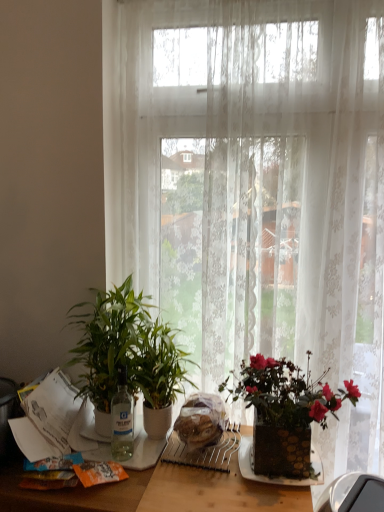
Question: Is transparent glass bottle at center thinner than green glossy plant at left, marked as the 1th houseplant in a left-to-right arrangement?

Choices:
 (A) yes
 (B) no

Answer: (A)

Question: Can you confirm if transparent glass bottle at center is wider than green glossy plant at left, marked as the 1th houseplant in a left-to-right arrangement?

Choices:
 (A) no
 (B) yes

Answer: (A)

Question: Is transparent glass bottle at center at the left side of green glossy plant at left, marked as the 1th houseplant in a left-to-right arrangement?

Choices:
 (A) yes
 (B) no

Answer: (B)

Question: From the image's perspective, is transparent glass bottle at center on top of green glossy plant at left, the second houseplant positioned from the right?

Choices:
 (A) no
 (B) yes

Answer: (A)

Question: Is transparent glass bottle at center shorter than green glossy plant at left, the second houseplant positioned from the right?

Choices:
 (A) yes
 (B) no

Answer: (A)

Question: From a real-world perspective, is green glossy plant at center, acting as the 1th houseplant starting from the right, above or below wooden table at center?

Choices:
 (A) below
 (B) above

Answer: (B)

Question: Is green glossy plant at center, acting as the 1th houseplant starting from the right, bigger or smaller than wooden table at center?

Choices:
 (A) big
 (B) small

Answer: (B)

Question: Is green glossy plant at center, which is the 2th houseplant in left-to-right order, wider or thinner than wooden table at center?

Choices:
 (A) thin
 (B) wide

Answer: (A)

Question: Is green glossy plant at center, which is the 2th houseplant in left-to-right order, in front of or behind wooden table at center in the image?

Choices:
 (A) behind
 (B) front

Answer: (A)

Question: In terms of height, does green glossy plant at left, the second houseplant positioned from the right, look taller or shorter compared to translucent plastic bread at center?

Choices:
 (A) short
 (B) tall

Answer: (B)

Question: Looking at the image, does green glossy plant at left, the second houseplant positioned from the right, seem bigger or smaller compared to translucent plastic bread at center?

Choices:
 (A) big
 (B) small

Answer: (A)

Question: Is point (127, 275) closer or farther from the camera than point (205, 411)?

Choices:
 (A) farther
 (B) closer

Answer: (A)

Question: Is green glossy plant at left, the second houseplant positioned from the right, to the left or to the right of translucent plastic bread at center in the image?

Choices:
 (A) left
 (B) right

Answer: (A)

Question: Choose the correct answer: Is green glossy plant at center, which is the 2th houseplant in left-to-right order, inside white lace curtain at center or outside it?

Choices:
 (A) outside
 (B) inside

Answer: (A)

Question: Considering the positions of green glossy plant at center, acting as the 1th houseplant starting from the right, and white lace curtain at center in the image, is green glossy plant at center, acting as the 1th houseplant starting from the right, wider or thinner than white lace curtain at center?

Choices:
 (A) thin
 (B) wide

Answer: (B)